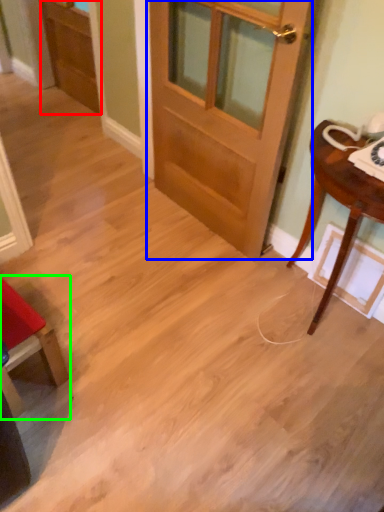
Question: Estimate the real-world distances between objects in this image. Which object is closer to screen door (highlighted by a red box), door (highlighted by a blue box) or chair (highlighted by a green box)?

Choices:
 (A) door
 (B) chair

Answer: (A)